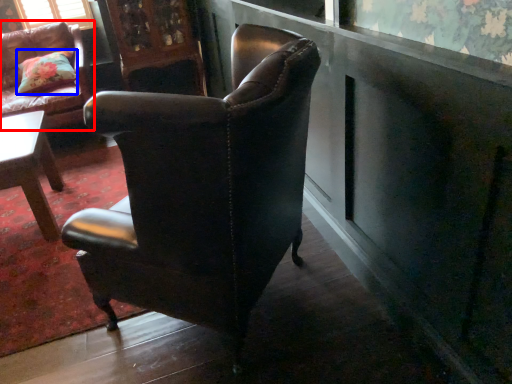
Question: Which point is further to the camera, chair (highlighted by a red box) or pillow (highlighted by a blue box)?

Choices:
 (A) chair
 (B) pillow

Answer: (B)